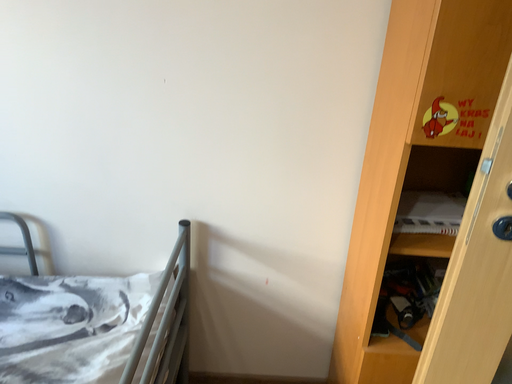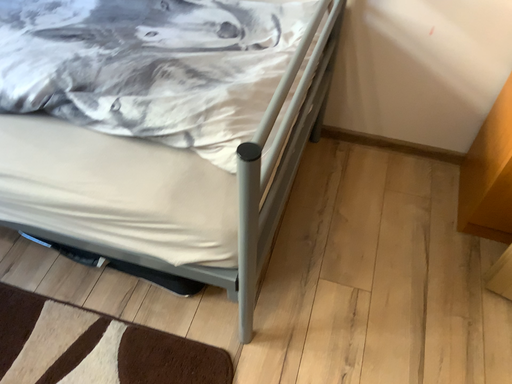
Question: Which way did the camera rotate in the video?

Choices:
 (A) rotated left
 (B) rotated right

Answer: (A)